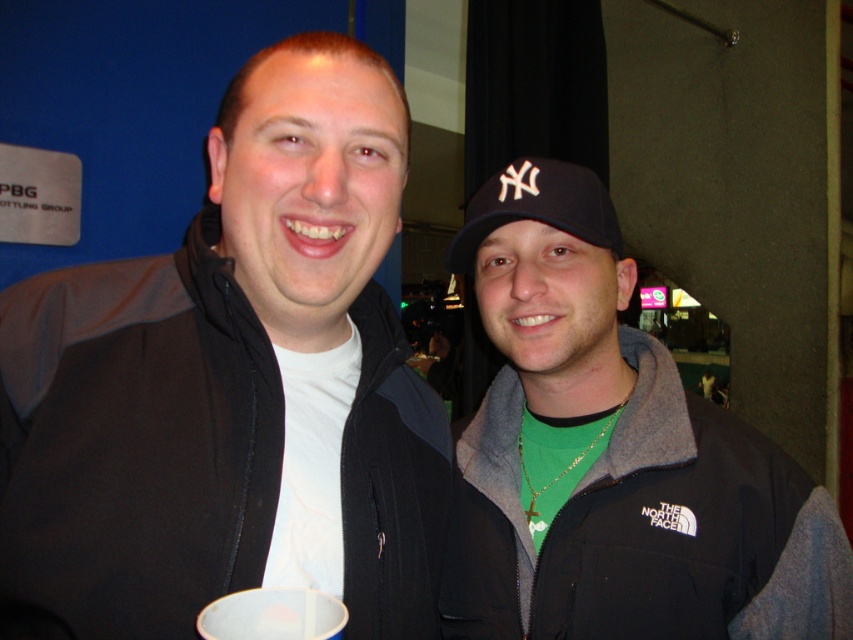
You are a photographer trying to capture a clear shot of the black matte jacket at center and the white plastic cup at center in the image. Since the camera can only focus on objects of a certain height, which object should you prioritize to ensure it is in focus?

The black matte jacket at center is much taller than the white plastic cup at center, so you should prioritize focusing on the black matte jacket at center to ensure it is in focus.

You are at a social event and want to take a photo of the white plastic cup at center without the black fabric baseball cap at center blocking it. How should you adjust your camera angle?

Move the camera to a position where the white plastic cup at center is no longer behind the black fabric baseball cap at center, such as shifting to the side or adjusting the angle to capture the cup in front.